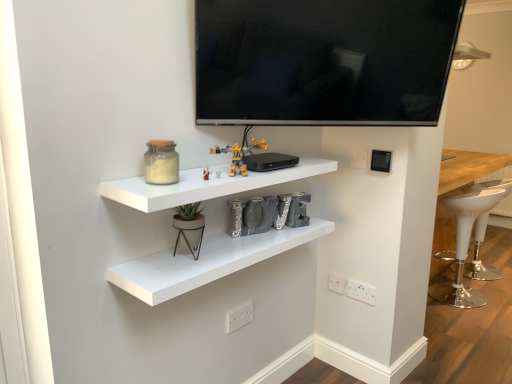
Question: Is point (343, 284) positioned closer to the camera than point (237, 317)?

Choices:
 (A) farther
 (B) closer

Answer: (A)

Question: Relative to white plastic electric outlet at lower center, which appears as the fourth electric outlet when viewed from the right, is white plastic electric outlet at lower center, the second electric outlet from the left, in front or behind?

Choices:
 (A) front
 (B) behind

Answer: (B)

Question: Which is farther from the translucent glass jar at upper left?

Choices:
 (A) white plastic electric outlet at lower center, the second electric outlet viewed from the front
 (B) flat screen tv at upper center
 (C) metallic yellow toy at center, the 2th toy when ordered from right to left
 (D) white plastic bar stool at right, marked as the 1th bar stool in a left-to-right arrangement
 (E) white matte shelf at center, which ranks as the 2th shelf in top-to-bottom order

Answer: (D)

Question: Estimate the real-world distances between objects in this image. Which object is closer to the white plastic electric outlet at lower center, the second electric outlet from the left?

Choices:
 (A) white plastic electric outlet at lower right, acting as the 4th electric outlet starting from the left
 (B) white plastic electric outlet at lower center, acting as the first electric outlet starting from the bottom
 (C) flat screen tv at upper center
 (D) yellow plastic toy at center, the 3th toy when ordered from bottom to top
 (E) white plastic bar stool at right, which is counted as the first bar stool, starting from the right

Answer: (A)